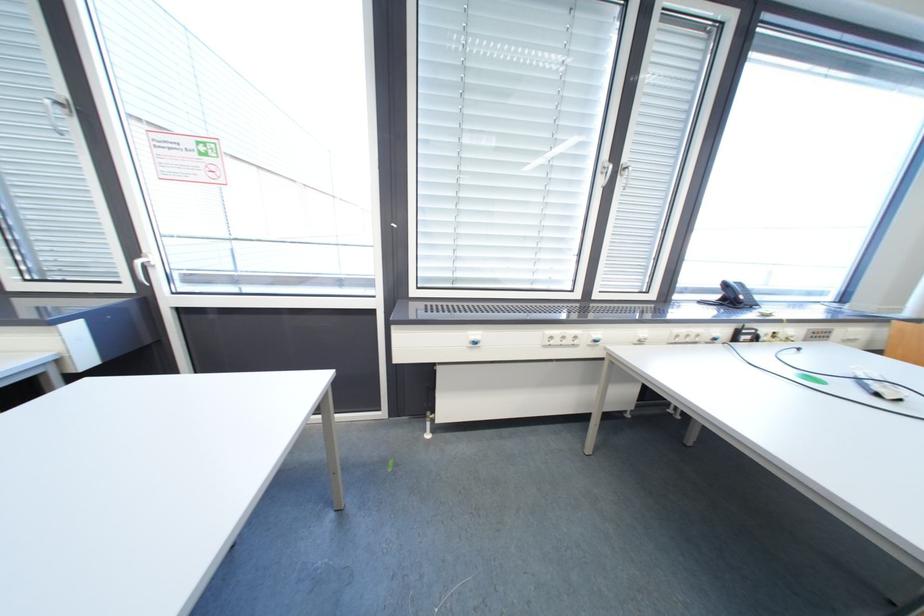
Where would you lift the black telephone handset? Please return your answer as a coordinate pair (x, y).

(747, 296)